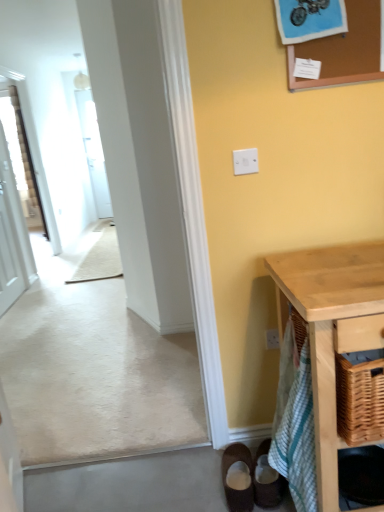
Question: From the image's perspective, is green striped cloth at lower right positioned above or below brown suede shoes at lower center, marked as the first footwear in a left-to-right arrangement?

Choices:
 (A) above
 (B) below

Answer: (A)

Question: In terms of height, does green striped cloth at lower right look taller or shorter compared to brown suede shoes at lower center, the second footwear positioned from the right?

Choices:
 (A) tall
 (B) short

Answer: (A)

Question: Which of these objects is positioned closest to the brown suede shoes at lower center, marked as the first footwear in a left-to-right arrangement?

Choices:
 (A) white glossy door at left
 (B) brown suede shoes at lower right, which is the 2th footwear in left-to-right order
 (C) white plastic light switch at center
 (D) green striped cloth at lower right
 (E) light wood table at lower right

Answer: (B)

Question: Based on their relative distances, which object is nearer to the brown suede shoes at lower center, marked as the first footwear in a left-to-right arrangement?

Choices:
 (A) corkboard at upper right
 (B) green striped cloth at lower right
 (C) white glossy door at left
 (D) brown suede shoes at lower right, positioned as the first footwear in right-to-left order
 (E) light wood table at lower right

Answer: (D)